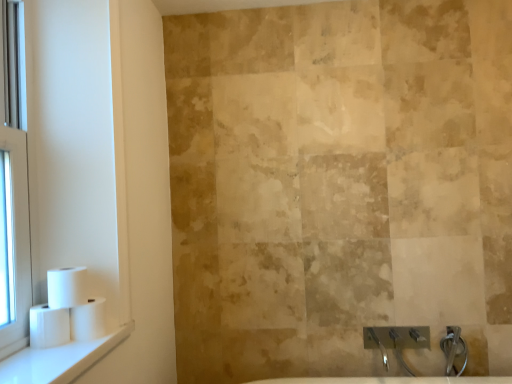
The width and height of the screenshot is (512, 384). What do you see at coordinates (67, 287) in the screenshot?
I see `white matte toilet paper at left, which is counted as the 2th toilet paper, starting from the left` at bounding box center [67, 287].

What is the approximate width of white matte toilet paper at left, the second toilet paper positioned from the right?

4.12 inches.

How much space does white matte toilet paper at left, placed as the third toilet paper when sorted from left to right, occupy horizontally?

The width of white matte toilet paper at left, placed as the third toilet paper when sorted from left to right, is 4.34 inches.

Locate an element on the screen. The width and height of the screenshot is (512, 384). white plastic toilet paper rolls at left is located at coordinates (75, 167).

Does white glossy window sill at lower left lie behind white matte toilet paper at left, which is counted as the 2th toilet paper, starting from the left?

No.

Does white glossy window sill at lower left have a greater width compared to white matte toilet paper at left, which is counted as the 2th toilet paper, starting from the left?

Indeed, white glossy window sill at lower left has a greater width compared to white matte toilet paper at left, which is counted as the 2th toilet paper, starting from the left.

Looking at this image, what's the angular difference between white glossy window sill at lower left and white matte toilet paper at left, which is counted as the 2th toilet paper, starting from the left,'s facing directions?

They differ by 0.701 degrees in their facing directions.

Can you confirm if white glossy window sill at lower left is shorter than white matte toilet paper at left, the second toilet paper positioned from the right?

Yes, white glossy window sill at lower left is shorter than white matte toilet paper at left, the second toilet paper positioned from the right.

Are white glossy window sill at lower left and white matte toilet paper at left, which ranks as the 1th toilet paper in left-to-right order, making contact?

No, white glossy window sill at lower left is not touching white matte toilet paper at left, which ranks as the 1th toilet paper in left-to-right order.

Does white glossy window sill at lower left appear on the right side of white matte toilet paper at left, the 3th toilet paper viewed from the right?

Correct, you'll find white glossy window sill at lower left to the right of white matte toilet paper at left, the 3th toilet paper viewed from the right.

From a real-world perspective, is white glossy window sill at lower left above or below white matte toilet paper at left, the 3th toilet paper viewed from the right?

white glossy window sill at lower left is situated lower than white matte toilet paper at left, the 3th toilet paper viewed from the right, in the real world.

Is point (37, 379) farther from camera compared to point (59, 316)?

No, (37, 379) is in front of (59, 316).

Does white matte toilet paper at left, placed as the third toilet paper when sorted from left to right, have a larger size compared to clear glass window at left?

No.

Where is `toilet paper that is the 3rd object to the right of the clear glass window at left, starting at the anchor`? The height and width of the screenshot is (384, 512). toilet paper that is the 3rd object to the right of the clear glass window at left, starting at the anchor is located at coordinates (88, 320).

Does white matte toilet paper at left, which ranks as the 1th toilet paper in right-to-left order, have a greater height compared to clear glass window at left?

In fact, white matte toilet paper at left, which ranks as the 1th toilet paper in right-to-left order, may be shorter than clear glass window at left.

Is the surface of white matte toilet paper at left, placed as the third toilet paper when sorted from left to right, in direct contact with clear glass window at left?

white matte toilet paper at left, placed as the third toilet paper when sorted from left to right, and clear glass window at left are not in contact.

Based on the photo, between white glossy window sill at lower left and white plastic toilet paper rolls at left, which one has smaller width?

With smaller width is white plastic toilet paper rolls at left.

From a real-world perspective, is white glossy window sill at lower left beneath white plastic toilet paper rolls at left?

Yes, from a real-world perspective, white glossy window sill at lower left is under white plastic toilet paper rolls at left.

Considering the sizes of white glossy window sill at lower left and white plastic toilet paper rolls at left in the image, is white glossy window sill at lower left bigger or smaller than white plastic toilet paper rolls at left?

Considering their sizes, white glossy window sill at lower left takes up less space than white plastic toilet paper rolls at left.

Is white matte toilet paper at left, placed as the third toilet paper when sorted from left to right, surrounding white matte toilet paper at left, the 3th toilet paper viewed from the right?

No, white matte toilet paper at left, the 3th toilet paper viewed from the right, is located outside of white matte toilet paper at left, placed as the third toilet paper when sorted from left to right.

Could you tell me if white matte toilet paper at left, which ranks as the 1th toilet paper in right-to-left order, is facing white matte toilet paper at left, which ranks as the 1th toilet paper in left-to-right order?

No, white matte toilet paper at left, which ranks as the 1th toilet paper in right-to-left order, is not facing towards white matte toilet paper at left, which ranks as the 1th toilet paper in left-to-right order.

Between white matte toilet paper at left, which ranks as the 1th toilet paper in right-to-left order, and white matte toilet paper at left, which ranks as the 1th toilet paper in left-to-right order, which one has less height?

white matte toilet paper at left, which ranks as the 1th toilet paper in left-to-right order, is shorter.

How far apart are white matte toilet paper at left, placed as the third toilet paper when sorted from left to right, and white matte toilet paper at left, which ranks as the 1th toilet paper in left-to-right order?

white matte toilet paper at left, placed as the third toilet paper when sorted from left to right, is 2.21 inches away from white matte toilet paper at left, which ranks as the 1th toilet paper in left-to-right order.

Is white matte toilet paper at left, the 3th toilet paper viewed from the right, at the back of white matte toilet paper at left, the second toilet paper positioned from the right?

That's not correct — white matte toilet paper at left, the second toilet paper positioned from the right, is not looking away from white matte toilet paper at left, the 3th toilet paper viewed from the right.

Where is `toilet paper in front of the white matte toilet paper at left, the second toilet paper positioned from the right`? Image resolution: width=512 pixels, height=384 pixels. toilet paper in front of the white matte toilet paper at left, the second toilet paper positioned from the right is located at coordinates (49, 326).

From the image's perspective, is white matte toilet paper at left, the second toilet paper positioned from the right, positioned above or below white matte toilet paper at left, the 3th toilet paper viewed from the right?

white matte toilet paper at left, the second toilet paper positioned from the right, is above white matte toilet paper at left, the 3th toilet paper viewed from the right.

Visually, is white plastic toilet paper rolls at left positioned to the left or to the right of clear glass window at left?

white plastic toilet paper rolls at left is to the right of clear glass window at left.

From a real-world perspective, between white plastic toilet paper rolls at left and clear glass window at left, who is vertically lower?

In real-world perspective, clear glass window at left is lower.

Would you say white plastic toilet paper rolls at left is outside clear glass window at left?

Indeed, white plastic toilet paper rolls at left is completely outside clear glass window at left.

Considering the points (50, 11) and (4, 276), which point is behind, point (50, 11) or point (4, 276)?

The point (50, 11) is farther from the camera.

From a real-world perspective, count 3rd toilet papers upward from the white glossy window sill at lower left and point to it. Please provide its 2D coordinates.

[(67, 287)]

There is a white glossy window sill at lower left. Where is `the 1st toilet paper above it (from the image's perspective)`? the 1st toilet paper above it (from the image's perspective) is located at coordinates (49, 326).

From the image, which object appears to be farther from white matte toilet paper at left, placed as the third toilet paper when sorted from left to right, clear glass window at left or white matte toilet paper at left, which ranks as the 1th toilet paper in left-to-right order?

Among the two, clear glass window at left is located further to white matte toilet paper at left, placed as the third toilet paper when sorted from left to right.

From the image, which object appears to be nearer to white plastic toilet paper rolls at left, white matte toilet paper at left, placed as the third toilet paper when sorted from left to right, or white glossy window sill at lower left?

white glossy window sill at lower left is closer to white plastic toilet paper rolls at left.

When comparing their distances from white plastic toilet paper rolls at left, does white matte toilet paper at left, which ranks as the 1th toilet paper in left-to-right order, or white glossy window sill at lower left seem further?

The object further to white plastic toilet paper rolls at left is white matte toilet paper at left, which ranks as the 1th toilet paper in left-to-right order.

When comparing their distances from white matte toilet paper at left, which ranks as the 1th toilet paper in left-to-right order, does white glossy window sill at lower left or white matte toilet paper at left, placed as the third toilet paper when sorted from left to right, seem further?

white glossy window sill at lower left is further to white matte toilet paper at left, which ranks as the 1th toilet paper in left-to-right order.

From the image, which object appears to be farther from white matte toilet paper at left, the 3th toilet paper viewed from the right, clear glass window at left or white glossy window sill at lower left?

clear glass window at left is positioned further to the anchor white matte toilet paper at left, the 3th toilet paper viewed from the right.

Considering their positions, is white matte toilet paper at left, which ranks as the 1th toilet paper in right-to-left order, positioned closer to white matte toilet paper at left, which is counted as the 2th toilet paper, starting from the left, than white glossy window sill at lower left?

Based on the image, white matte toilet paper at left, which ranks as the 1th toilet paper in right-to-left order, appears to be nearer to white matte toilet paper at left, which is counted as the 2th toilet paper, starting from the left.

Considering their positions, is clear glass window at left positioned further to white glossy window sill at lower left than white plastic toilet paper rolls at left?

white plastic toilet paper rolls at left is further to white glossy window sill at lower left.

From the image, which object appears to be nearer to white matte toilet paper at left, which is counted as the 2th toilet paper, starting from the left, clear glass window at left or white glossy window sill at lower left?

white glossy window sill at lower left.

I want to click on toilet paper between white plastic toilet paper rolls at left and white matte toilet paper at left, placed as the third toilet paper when sorted from left to right, from top to bottom, so click(x=67, y=287).

This screenshot has width=512, height=384. Find the location of `window between white plastic toilet paper rolls at left and white matte toilet paper at left, which is counted as the 2th toilet paper, starting from the left, in the up-down direction`. window between white plastic toilet paper rolls at left and white matte toilet paper at left, which is counted as the 2th toilet paper, starting from the left, in the up-down direction is located at coordinates (14, 188).

This screenshot has width=512, height=384. I want to click on toilet paper between clear glass window at left and white matte toilet paper at left, placed as the third toilet paper when sorted from left to right, in the vertical direction, so click(67, 287).

Find the location of a particular element. toilet paper between white matte toilet paper at left, the second toilet paper positioned from the right, and white matte toilet paper at left, which ranks as the 1th toilet paper in left-to-right order, in the up-down direction is located at coordinates (88, 320).